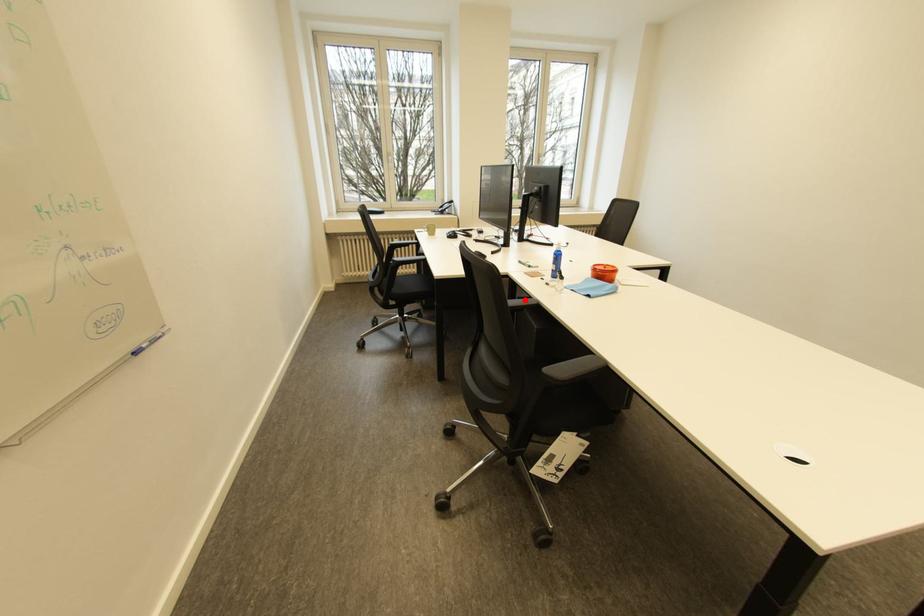
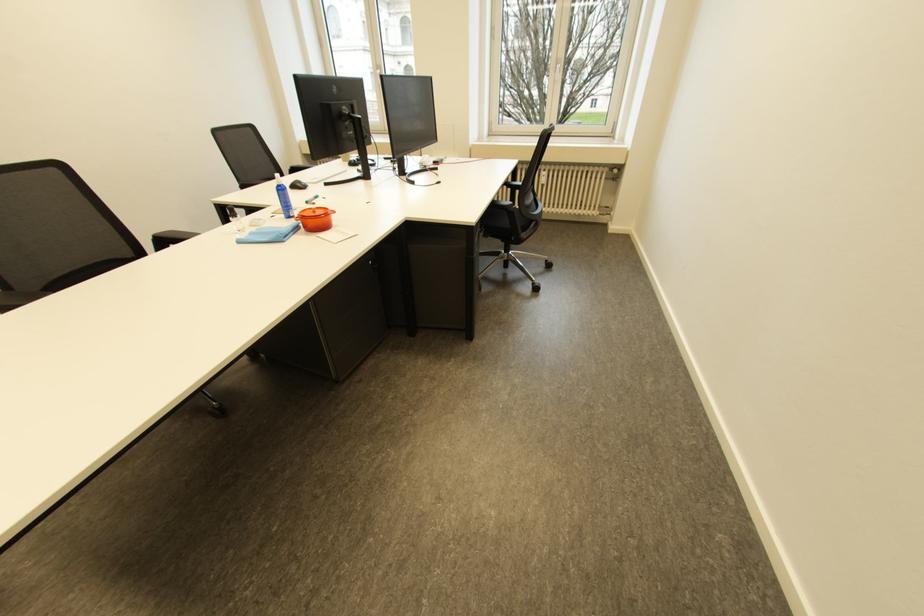
Question: I am providing you with two images of the same scene from different viewpoints. A red point is marked on the first image. Is the red point's position out of view in image 2?

Choices:
 (A) Yes
 (B) No

Answer: (A)